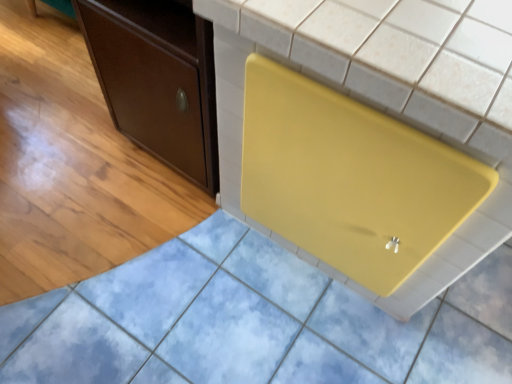
Question: In terms of width, does matte brown cabinet at left look wider or thinner when compared to yellow matte cutting board at center?

Choices:
 (A) thin
 (B) wide

Answer: (A)

Question: From a real-world perspective, is matte brown cabinet at left positioned above or below yellow matte cutting board at center?

Choices:
 (A) below
 (B) above

Answer: (A)

Question: Looking at the image, does matte brown cabinet at left seem bigger or smaller compared to yellow matte cutting board at center?

Choices:
 (A) big
 (B) small

Answer: (B)

Question: From the image's perspective, relative to matte brown cabinet at left, is yellow matte cutting board at center above or below?

Choices:
 (A) below
 (B) above

Answer: (A)

Question: Is yellow matte cutting board at center taller or shorter than matte brown cabinet at left?

Choices:
 (A) tall
 (B) short

Answer: (A)

Question: Does point (345, 193) appear closer or farther from the camera than point (181, 139)?

Choices:
 (A) farther
 (B) closer

Answer: (B)

Question: Based on their sizes in the image, would you say yellow matte cutting board at center is bigger or smaller than matte brown cabinet at left?

Choices:
 (A) small
 (B) big

Answer: (B)